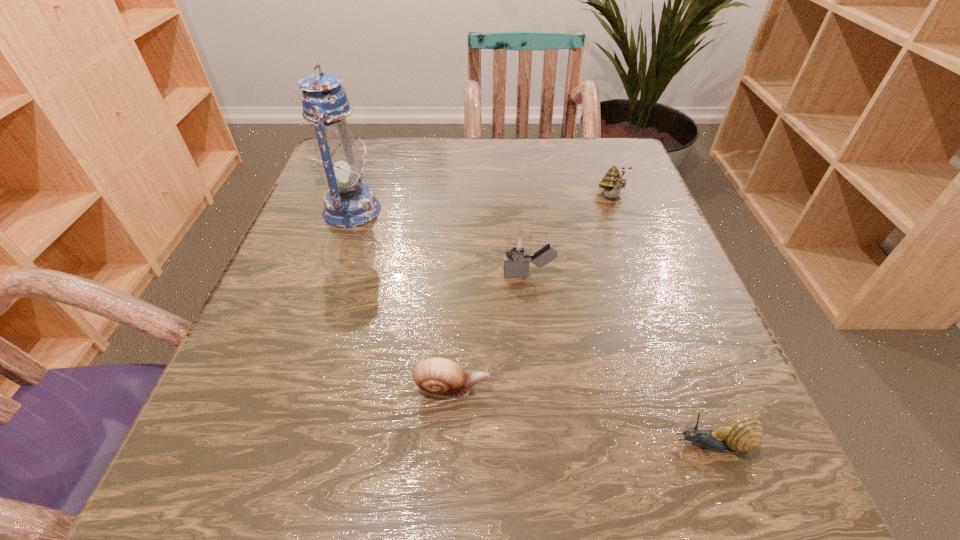
You are a GUI agent. You are given a task and a screenshot of the screen. Output one action in this format:
    pyautogui.click(x=<x>, y=<y>)
    Task: Click on the vacant area located 0.260m on the back of the third farthest object
    This screenshot has width=960, height=540.
    Given the screenshot: What is the action you would take?
    pyautogui.click(x=518, y=184)

This screenshot has width=960, height=540. Find the location of `vacant space located on the front-facing side of the second farthest escargot`. vacant space located on the front-facing side of the second farthest escargot is located at coordinates tap(663, 389).

Image resolution: width=960 pixels, height=540 pixels. Find the location of `vacant space located 0.090m on the front-facing side of the nearest escargot`. vacant space located 0.090m on the front-facing side of the nearest escargot is located at coordinates (600, 444).

Where is `vacant space located on the front-facing side of the nearest escargot`? The width and height of the screenshot is (960, 540). vacant space located on the front-facing side of the nearest escargot is located at coordinates (457, 444).

Locate an element on the screen. The width and height of the screenshot is (960, 540). free region located 0.230m on the front-facing side of the nearest escargot is located at coordinates (489, 444).

Locate an element on the screen. This screenshot has width=960, height=540. lantern present at the far edge is located at coordinates (349, 203).

This screenshot has width=960, height=540. What are the coordinates of `snail present at the far edge` in the screenshot? It's located at (612, 182).

Locate an element on the screen. This screenshot has width=960, height=540. object that is positioned at the near edge is located at coordinates 742,433.

Find the location of `object that is positioned at the left edge`. object that is positioned at the left edge is located at coordinates (349, 203).

Where is `object that is at the far left corner`? The height and width of the screenshot is (540, 960). object that is at the far left corner is located at coordinates (349, 203).